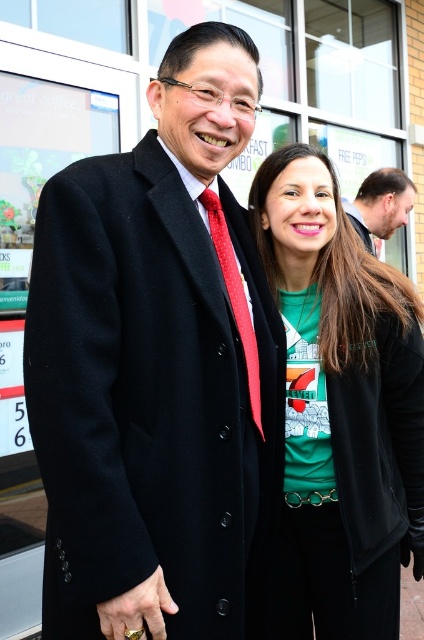
Question: Which of these objects is positioned farthest from the dark brown leather jacket at upper right?

Choices:
 (A) green matte shirt at center
 (B) red dotted tie at center

Answer: (B)

Question: Is green matte shirt at center closer to the viewer compared to red dotted tie at center?

Choices:
 (A) no
 (B) yes

Answer: (A)

Question: Does green matte shirt at center appear on the right side of red dotted tie at center?

Choices:
 (A) yes
 (B) no

Answer: (A)

Question: Which object is closer to the camera taking this photo?

Choices:
 (A) dark brown leather jacket at upper right
 (B) red dotted tie at center

Answer: (B)

Question: Which of these objects is positioned closest to the green matte shirt at center?

Choices:
 (A) red dotted tie at center
 (B) dark brown leather jacket at upper right

Answer: (A)

Question: Can you confirm if green matte shirt at center is thinner than red dotted tie at center?

Choices:
 (A) yes
 (B) no

Answer: (B)